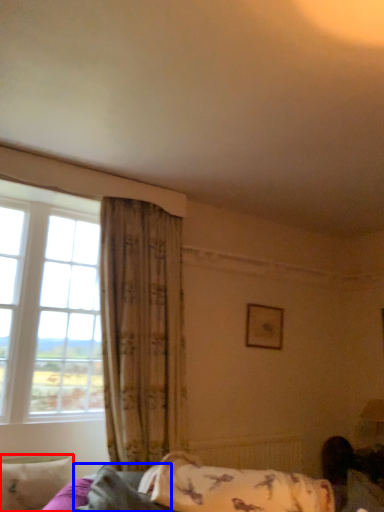
Question: Among these objects, which one is farthest to the camera, pillow (highlighted by a red box) or pillow (highlighted by a blue box)?

Choices:
 (A) pillow
 (B) pillow

Answer: (A)